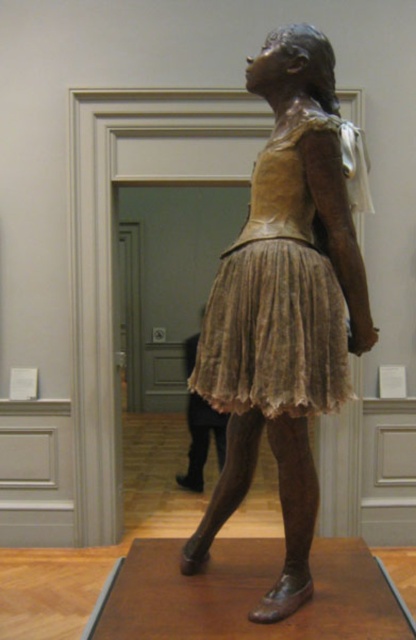
Question: Does bronze textured sculpture at center come behind matte bronze dress at center?

Choices:
 (A) no
 (B) yes

Answer: (B)

Question: Among these points, which one is nearest to the camera?

Choices:
 (A) (280, 186)
 (B) (348, 289)

Answer: (A)

Question: Does bronze textured sculpture at center appear under matte bronze dress at center?

Choices:
 (A) yes
 (B) no

Answer: (A)

Question: Which of the following is the farthest from the observer?

Choices:
 (A) (312, 522)
 (B) (304, 301)

Answer: (A)

Question: Does bronze textured sculpture at center lie behind matte bronze dress at center?

Choices:
 (A) no
 (B) yes

Answer: (B)